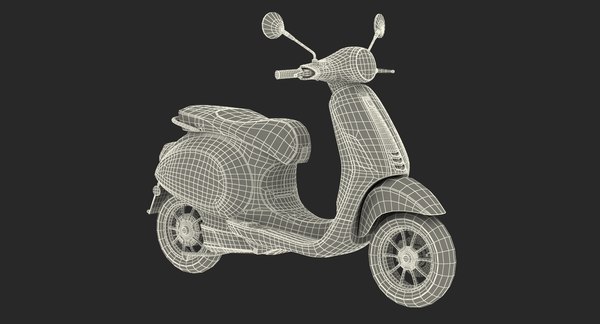
Identify the location of right handle. (284, 75).